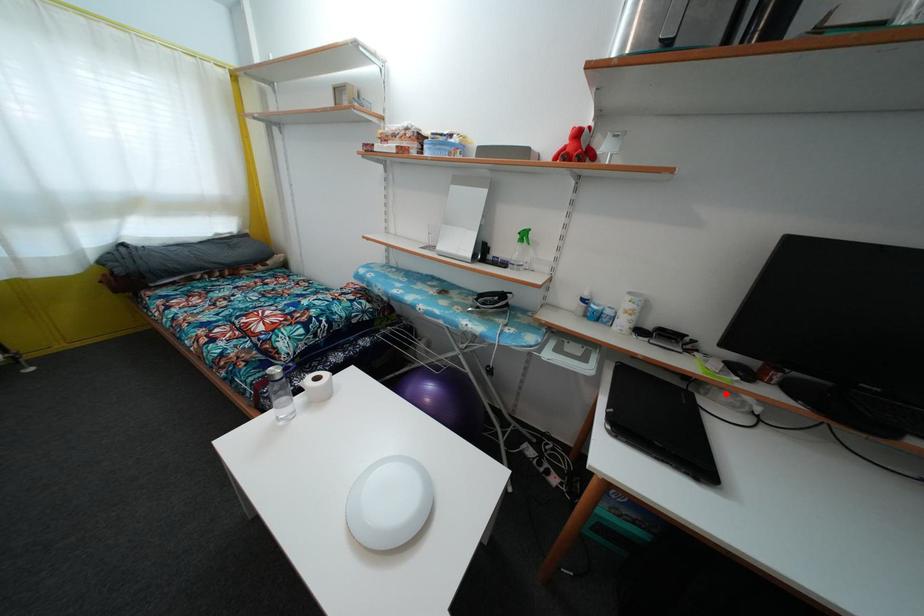
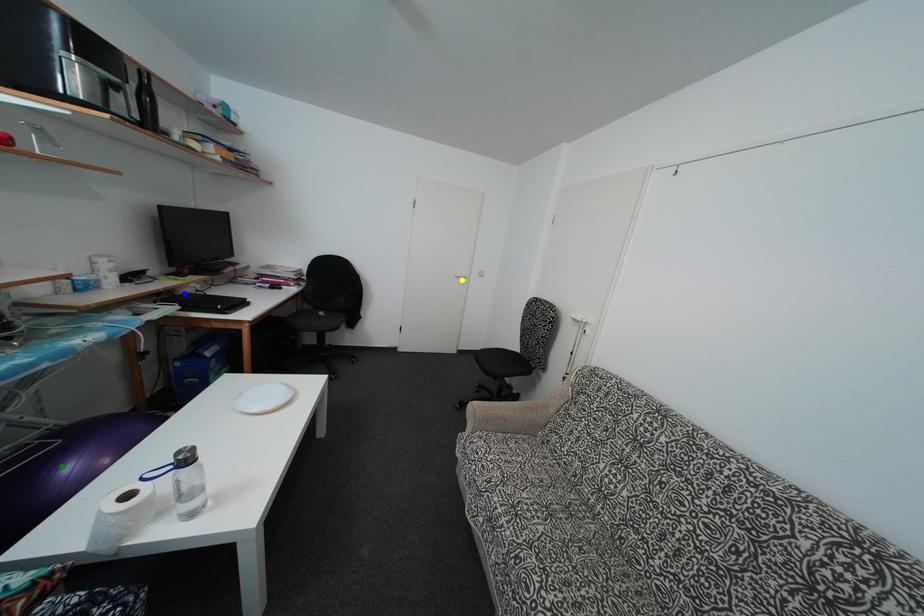
Question: I am providing you with two images of the same scene from different viewpoints. A red point is marked on the first image. You are given multiple points on the second image. Can you choose the point in image 2 that corresponds to the point in image 1?

Choices:
 (A) yellow point
 (B) green point
 (C) blue point

Answer: (C)